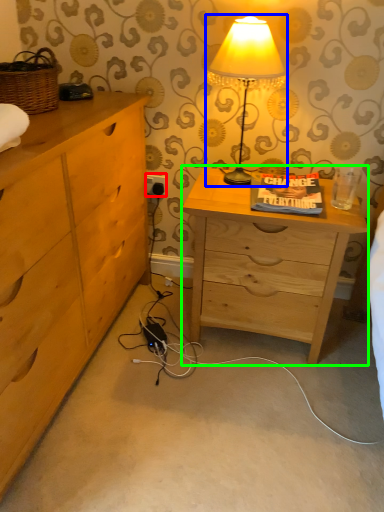
Question: Which object is positioned closest to electric outlet (highlighted by a red box)? Select from lamp (highlighted by a blue box) and nightstand (highlighted by a green box).

Choices:
 (A) lamp
 (B) nightstand

Answer: (A)